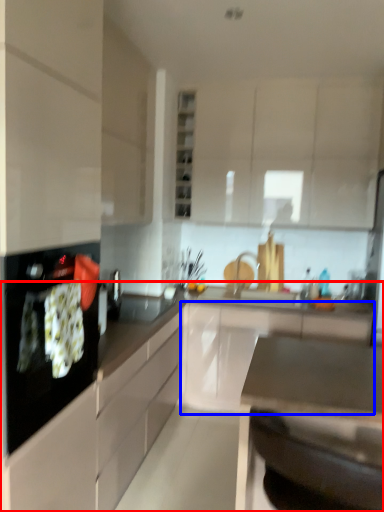
Question: Which of the following is the farthest to the observer, countertop (highlighted by a red box) or cabinetry (highlighted by a blue box)?

Choices:
 (A) countertop
 (B) cabinetry

Answer: (B)